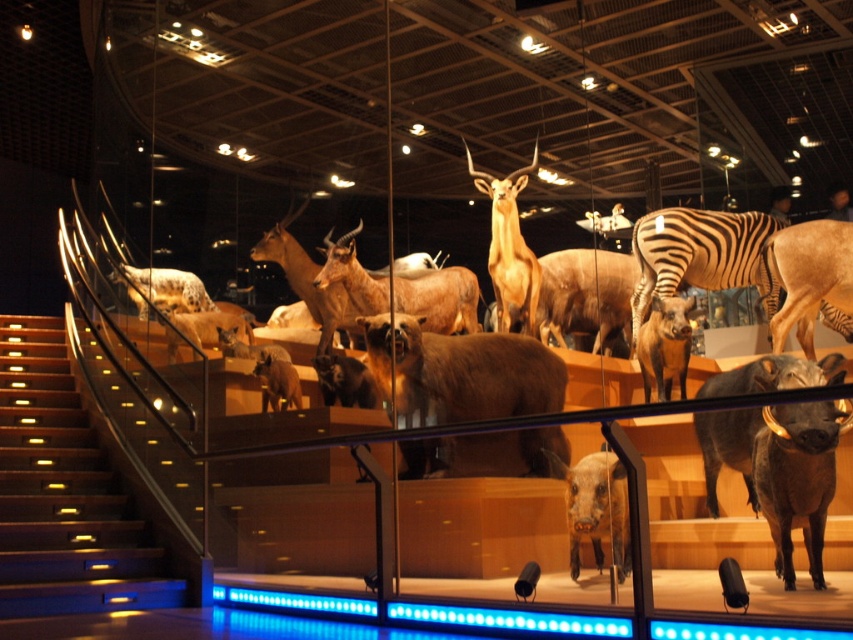
Question: Is yellow-lit wood stairs at lower left bigger than brown matte pig at center?

Choices:
 (A) no
 (B) yes

Answer: (B)

Question: Which object is the farthest from the brown matte hyena at center?

Choices:
 (A) brown matte deer at center
 (B) brown matte pig at center

Answer: (A)

Question: Which of the following is the closest to the observer?

Choices:
 (A) brown matte cow at center
 (B) dark brown textured boar at center

Answer: (B)

Question: Among these objects, which one is farthest from the camera?

Choices:
 (A) brown matte pig at center
 (B) brown furry bear at center
 (C) brown matte hyena at center
 (D) brown matte cow at center

Answer: (D)

Question: Does brown furry bear at center come behind brown matte deer at center?

Choices:
 (A) no
 (B) yes

Answer: (A)

Question: Is black and white striped zebra at center above brown matte pig at center?

Choices:
 (A) no
 (B) yes

Answer: (B)